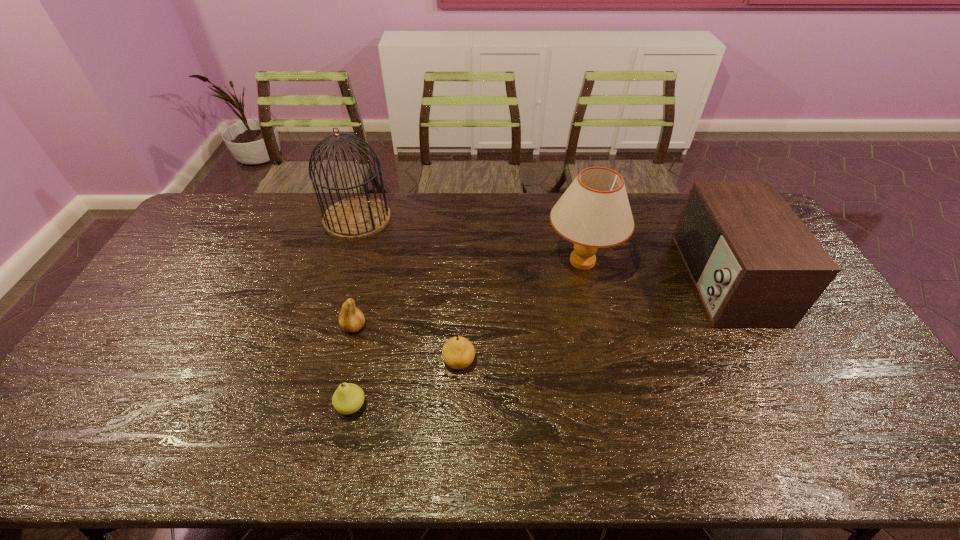
Find the location of a particular element. This screenshot has width=960, height=540. vacant space situated on the front-facing side of the third tallest object is located at coordinates (629, 279).

Identify the location of vacant space located on the front-facing side of the third tallest object. (616, 279).

This screenshot has width=960, height=540. I want to click on vacant space positioned 0.290m on the front-facing side of the third tallest object, so coord(590,279).

Image resolution: width=960 pixels, height=540 pixels. Find the location of `free space located on the back of the farthest pear`. free space located on the back of the farthest pear is located at coordinates (372, 259).

Locate an element on the screen. vacant space located 0.390m on the right of the second nearest pear is located at coordinates (620, 361).

In order to click on free space located 0.350m on the back of the nearest pear in this screenshot , I will do `click(376, 291)`.

Where is `object at the far edge`? This screenshot has height=540, width=960. object at the far edge is located at coordinates (357, 217).

Find the location of `object located in the right edge section of the desktop`. object located in the right edge section of the desktop is located at coordinates (754, 264).

In the image, there is a desktop. What are the coordinates of `vacant space at the far edge` in the screenshot? It's located at (516, 208).

The width and height of the screenshot is (960, 540). Identify the location of vacant space at the near edge of the desktop. (121, 436).